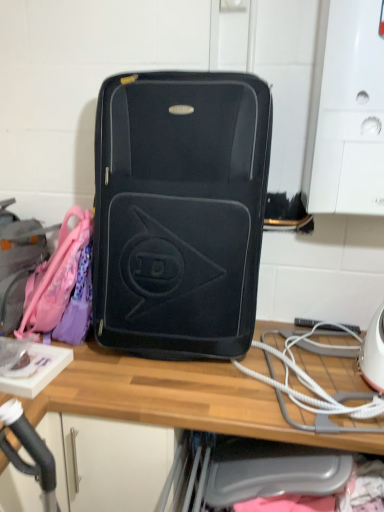
Question: From the image's perspective, is white cord at lower right above or below wooden desk at center?

Choices:
 (A) below
 (B) above

Answer: (B)

Question: Considering the positions of white cord at lower right and wooden desk at center in the image, is white cord at lower right taller or shorter than wooden desk at center?

Choices:
 (A) short
 (B) tall

Answer: (A)

Question: Which object is positioned farthest from the matte pink backpack at left?

Choices:
 (A) matte black suitcase at center
 (B) white cord at lower right
 (C) wooden desk at center

Answer: (B)

Question: Estimate the real-world distances between objects in this image. Which object is farther from the matte black suitcase at center?

Choices:
 (A) wooden desk at center
 (B) white cord at lower right
 (C) matte pink backpack at left

Answer: (C)